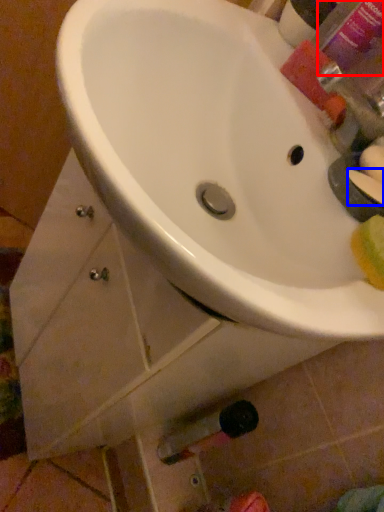
Question: Which object is closer to the camera taking this photo, mouthwash (highlighted by a red box) or soap (highlighted by a blue box)?

Choices:
 (A) mouthwash
 (B) soap

Answer: (B)